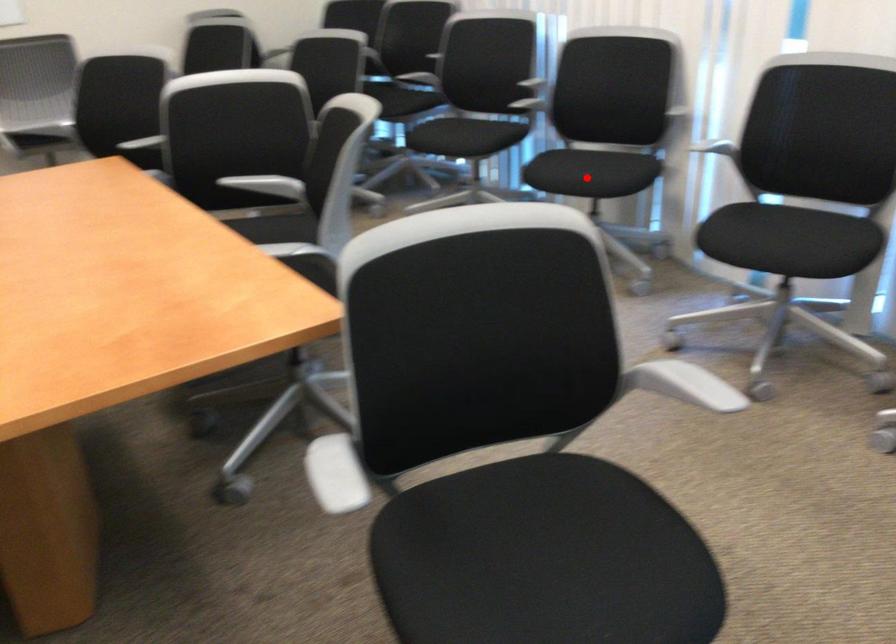
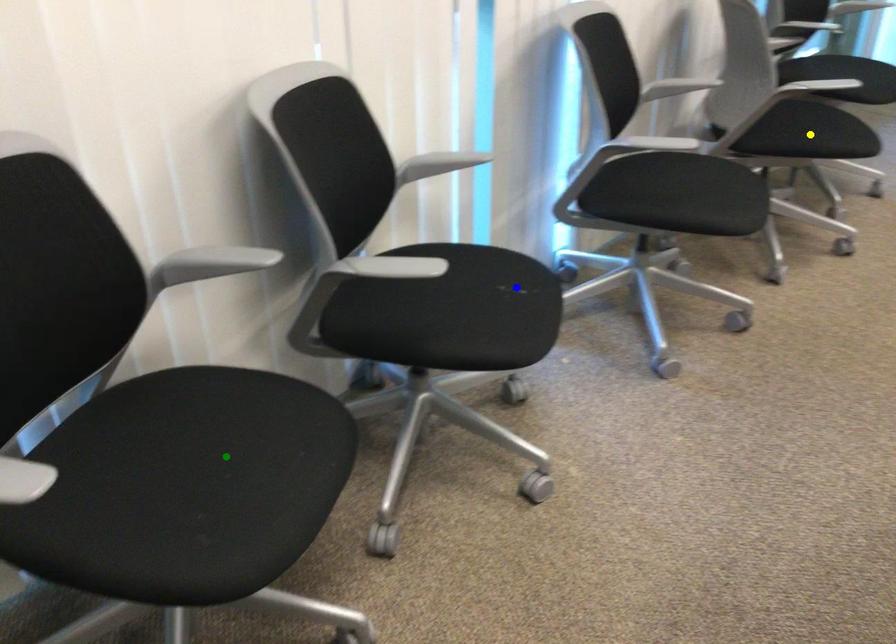
Question: I am providing you with two images of the same scene from different viewpoints. A red point is marked on the first image. You are given multiple points on the second image. Which point in image 2 is actually the same real-world point as the red point in image 1?

Choices:
 (A) yellow point
 (B) blue point
 (C) green point

Answer: (B)